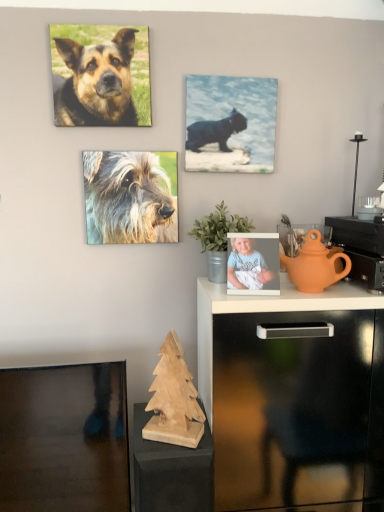
What do you see at coordinates (131, 196) in the screenshot? Image resolution: width=384 pixels, height=512 pixels. I see `fuzzy fur dog at center, which ranks as the second dog in top-to-bottom order` at bounding box center [131, 196].

Identify the location of wooden christmas tree at lower center. click(171, 471).

Where is `golden fur dog at upper left, which is the first dog from top to bottom`? golden fur dog at upper left, which is the first dog from top to bottom is located at coordinates (97, 83).

The height and width of the screenshot is (512, 384). What do you see at coordinates (97, 83) in the screenshot?
I see `golden fur dog at upper left, which is the first dog from top to bottom` at bounding box center [97, 83].

Where is `fuzzy fur dog at center, which ranks as the first dog in bottom-to-top order`? The image size is (384, 512). fuzzy fur dog at center, which ranks as the first dog in bottom-to-top order is located at coordinates (131, 196).

Is black glossy cat at upper center located within orange clay teapot at right?

No.

Locate an element on the screen. picture frame above the orange clay teapot at right (from the image's perspective) is located at coordinates (230, 124).

Considering the positions of objects orange clay teapot at right and black glossy cat at upper center in the image provided, who is more to the right, orange clay teapot at right or black glossy cat at upper center?

orange clay teapot at right is more to the right.

Does golden fur dog at upper left, which appears as the 2th dog when ordered from the bottom, lie in front of green matte plant at center?

No, it is behind green matte plant at center.

From a real-world perspective, which is physically above, golden fur dog at upper left, which appears as the 2th dog when ordered from the bottom, or green matte plant at center?

In real-world perspective, golden fur dog at upper left, which appears as the 2th dog when ordered from the bottom, is above.

The image size is (384, 512). Identify the location of the 2nd dog directly above the green matte plant at center (from a real-world perspective). (97, 83).

Which object is wider, golden fur dog at upper left, which is the first dog from top to bottom, or green matte plant at center?

With larger width is green matte plant at center.

Is orange clay teapot at right bigger or smaller than green matte plant at center?

Clearly, orange clay teapot at right is smaller in size than green matte plant at center.

Does orange clay teapot at right touch green matte plant at center?

There is a gap between orange clay teapot at right and green matte plant at center.

From a real-world perspective, between orange clay teapot at right and green matte plant at center, who is vertically lower?

orange clay teapot at right, from a real-world perspective.

From the image's perspective, is orange clay teapot at right above or below green matte plant at center?

Based on their image positions, orange clay teapot at right is located beneath green matte plant at center.

Does fuzzy fur dog at center, which ranks as the second dog in top-to-bottom order, have a greater height compared to black glossy cat at upper center?

In fact, fuzzy fur dog at center, which ranks as the second dog in top-to-bottom order, may be shorter than black glossy cat at upper center.

Can we say fuzzy fur dog at center, which ranks as the second dog in top-to-bottom order, lies outside black glossy cat at upper center?

Yes.

From the image's perspective, relative to black glossy cat at upper center, is fuzzy fur dog at center, which ranks as the second dog in top-to-bottom order, above or below?

From the image's perspective, fuzzy fur dog at center, which ranks as the second dog in top-to-bottom order, appears below black glossy cat at upper center.

Consider the image. Considering the positions of objects fuzzy fur dog at center, which ranks as the second dog in top-to-bottom order, and black glossy cat at upper center in the image provided, who is more to the right, fuzzy fur dog at center, which ranks as the second dog in top-to-bottom order, or black glossy cat at upper center?

black glossy cat at upper center is more to the right.

Can you confirm if green matte plant at center is taller than fuzzy fur dog at center, which ranks as the second dog in top-to-bottom order?

In fact, green matte plant at center may be shorter than fuzzy fur dog at center, which ranks as the second dog in top-to-bottom order.

In the scene shown: Is green matte plant at center closer to the viewer compared to fuzzy fur dog at center, which ranks as the first dog in bottom-to-top order?

Yes, it is.

Is green matte plant at center not within fuzzy fur dog at center, which ranks as the first dog in bottom-to-top order?

Yes.

Is point (249, 265) in front of point (207, 459)?

No, it is behind (207, 459).

Does light blue fabric baby at upper center turn towards wooden christmas tree at lower center?

No, light blue fabric baby at upper center is not aimed at wooden christmas tree at lower center.

Can you confirm if light blue fabric baby at upper center is thinner than wooden christmas tree at lower center?

Yes.

Looking at their sizes, would you say wooden christmas tree at lower center is wider or thinner than fuzzy fur dog at center, which ranks as the first dog in bottom-to-top order?

Considering their sizes, wooden christmas tree at lower center looks broader than fuzzy fur dog at center, which ranks as the first dog in bottom-to-top order.

Is point (143, 489) behind point (156, 210)?

No, it is in front of (156, 210).

Does wooden christmas tree at lower center appear on the right side of fuzzy fur dog at center, which ranks as the first dog in bottom-to-top order?

Yes, wooden christmas tree at lower center is to the right of fuzzy fur dog at center, which ranks as the first dog in bottom-to-top order.

Based on the photo, would you say fuzzy fur dog at center, which ranks as the second dog in top-to-bottom order, is part of wooden christmas tree at lower center's contents?

That's incorrect, fuzzy fur dog at center, which ranks as the second dog in top-to-bottom order, is not inside wooden christmas tree at lower center.

Find the location of `picture frame above the orange clay teapot at right (from the image's perspective)`. picture frame above the orange clay teapot at right (from the image's perspective) is located at coordinates (230, 124).

Locate an element on the screen. This screenshot has width=384, height=512. dog that is the 1st object located behind the green matte plant at center is located at coordinates (97, 83).

When comparing their distances from light blue fabric baby at upper center, does wooden christmas tree at lower center or green matte plant at center seem further?

wooden christmas tree at lower center is positioned further to the anchor light blue fabric baby at upper center.

Considering their positions, is wooden christmas tree at lower center positioned closer to green matte plant at center than golden fur dog at upper left, which appears as the 2th dog when ordered from the bottom?

golden fur dog at upper left, which appears as the 2th dog when ordered from the bottom, is positioned closer to the anchor green matte plant at center.

Based on their spatial positions, is green matte plant at center or wooden christmas tree at lower center further from golden fur dog at upper left, which is the first dog from top to bottom?

wooden christmas tree at lower center.

Looking at this image, which object lies further to the anchor point wooden christmas tree at lower center, orange clay teapot at right or green matte plant at center?

orange clay teapot at right is positioned further to the anchor wooden christmas tree at lower center.

When comparing their distances from wooden christmas tree at lower center, does black glossy cat at upper center or golden fur dog at upper left, which appears as the 2th dog when ordered from the bottom, seem closer?

The object closer to wooden christmas tree at lower center is black glossy cat at upper center.

Considering their positions, is light blue fabric baby at upper center positioned closer to orange clay teapot at right than golden fur dog at upper left, which appears as the 2th dog when ordered from the bottom?

light blue fabric baby at upper center lies closer to orange clay teapot at right than the other object.

Looking at the image, which one is located further to light blue fabric baby at upper center, black glossy cat at upper center or green matte plant at center?

Based on the image, black glossy cat at upper center appears to be further to light blue fabric baby at upper center.

Estimate the real-world distances between objects in this image. Which object is further from wooden christmas tree at lower center, green matte plant at center or light blue fabric baby at upper center?

green matte plant at center lies further to wooden christmas tree at lower center than the other object.

The height and width of the screenshot is (512, 384). I want to click on dog that lies between black glossy cat at upper center and green matte plant at center from top to bottom, so click(131, 196).

This screenshot has width=384, height=512. In order to click on dog between golden fur dog at upper left, which appears as the 2th dog when ordered from the bottom, and black glossy cat at upper center, in the horizontal direction in this screenshot , I will do `click(131, 196)`.

Locate an element on the screen. The image size is (384, 512). teapot between golden fur dog at upper left, which is the first dog from top to bottom, and wooden christmas tree at lower center vertically is located at coordinates (316, 265).

Where is `teapot between fuzzy fur dog at center, which ranks as the second dog in top-to-bottom order, and wooden christmas tree at lower center vertically`? teapot between fuzzy fur dog at center, which ranks as the second dog in top-to-bottom order, and wooden christmas tree at lower center vertically is located at coordinates point(316,265).